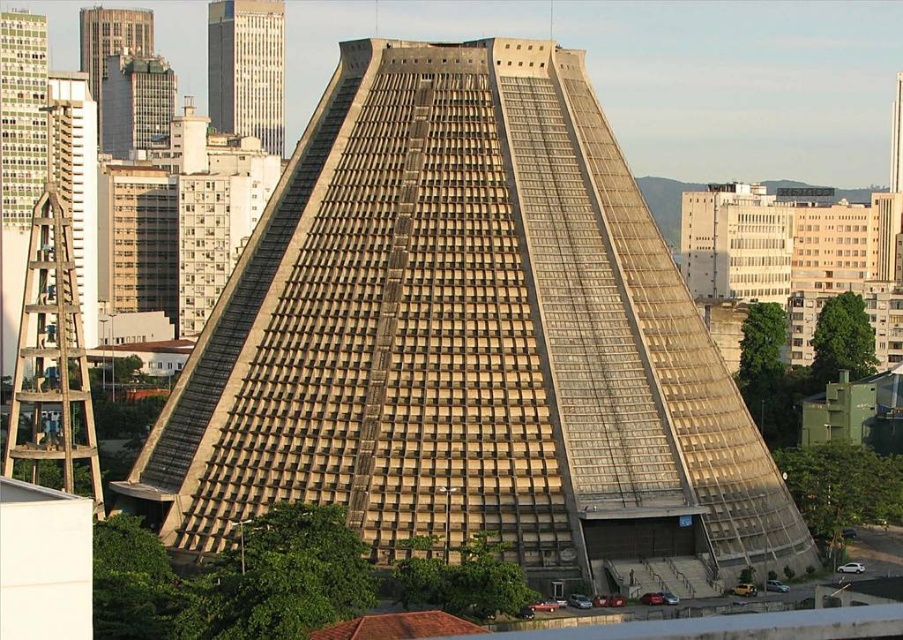
Question: In this image, where is smooth glass skyscraper at upper left located relative to metallic glass skyscraper at upper left?

Choices:
 (A) above
 (B) below

Answer: (A)

Question: Based on their relative distances, which object is nearer to the beige concrete pyramid at center?

Choices:
 (A) metallic glass skyscraper at upper left
 (B) smooth glass skyscraper at upper left

Answer: (A)

Question: Considering the real-world distances, which object is closest to the beige concrete pyramid at center?

Choices:
 (A) metallic glass skyscraper at upper left
 (B) smooth glass skyscraper at upper left

Answer: (A)

Question: Among these objects, which one is nearest to the camera?

Choices:
 (A) beige concrete pyramid at center
 (B) smooth glass skyscraper at upper left

Answer: (A)

Question: Does smooth glass skyscraper at upper left appear over metallic glass skyscraper at upper left?

Choices:
 (A) yes
 (B) no

Answer: (A)

Question: Observing the image, what is the correct spatial positioning of smooth glass skyscraper at upper left in reference to metallic glass skyscraper at upper left?

Choices:
 (A) below
 (B) above

Answer: (B)